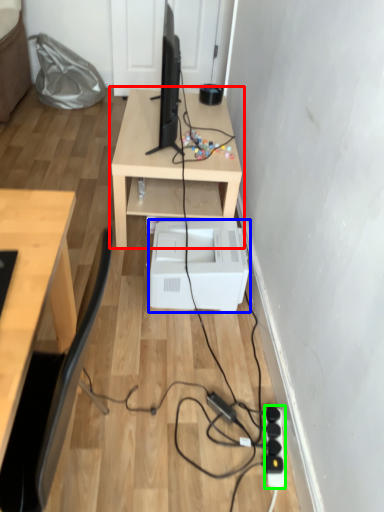
Question: Which object is positioned closest to table (highlighted by a red box)? Select from printer (highlighted by a blue box) and extension cord (highlighted by a green box).

Choices:
 (A) printer
 (B) extension cord

Answer: (A)